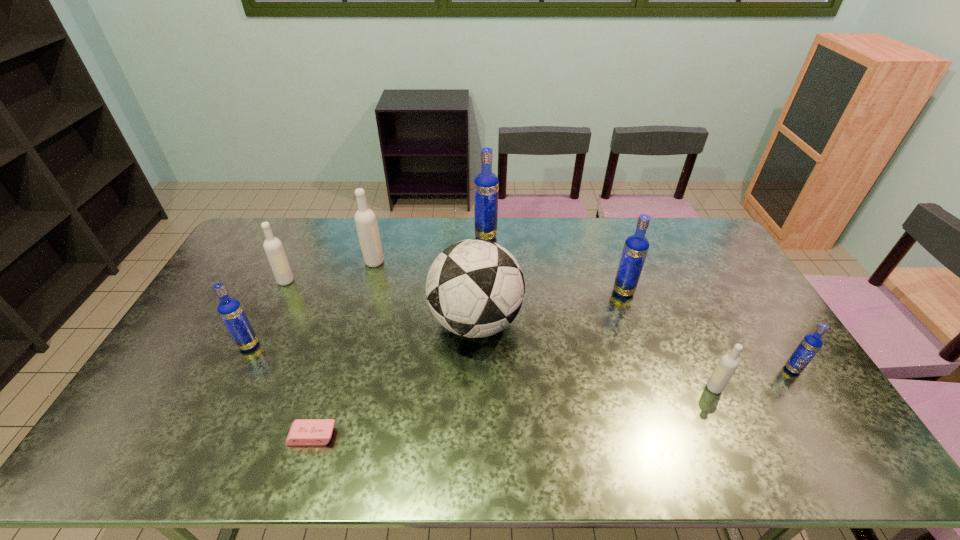
In the image, there is a desktop. At what (x,y) coordinates should I click in order to perform the action: click on free space at the left edge. Please return your answer as a coordinate pair (x, y). Looking at the image, I should click on (242, 256).

Identify the location of free region at the right edge. (715, 313).

Locate an element on the screen. free space between the second nearest white vodka and the second farthest object is located at coordinates (330, 272).

Where is `vacant region between the farthest white vodka and the biggest blue vodka`? The height and width of the screenshot is (540, 960). vacant region between the farthest white vodka and the biggest blue vodka is located at coordinates (430, 249).

Find the location of a particular element. unoccupied position between the farthest white vodka and the soccer ball is located at coordinates (425, 292).

What are the coordinates of `vacant point located between the farthest vodka and the third biggest blue vodka` in the screenshot? It's located at (368, 291).

What are the coordinates of `vacant space that is in between the third nearest blue vodka and the tallest vodka` in the screenshot? It's located at (555, 264).

This screenshot has width=960, height=540. In order to click on free spot between the fifth farthest vodka and the black soccer ball in this screenshot , I will do `click(362, 334)`.

The width and height of the screenshot is (960, 540). I want to click on free space between the second biggest white vodka and the rightmost white vodka, so coord(500,335).

Locate an element on the screen. This screenshot has height=540, width=960. free space between the pink eraser and the second white vodka from right to left is located at coordinates (344, 349).